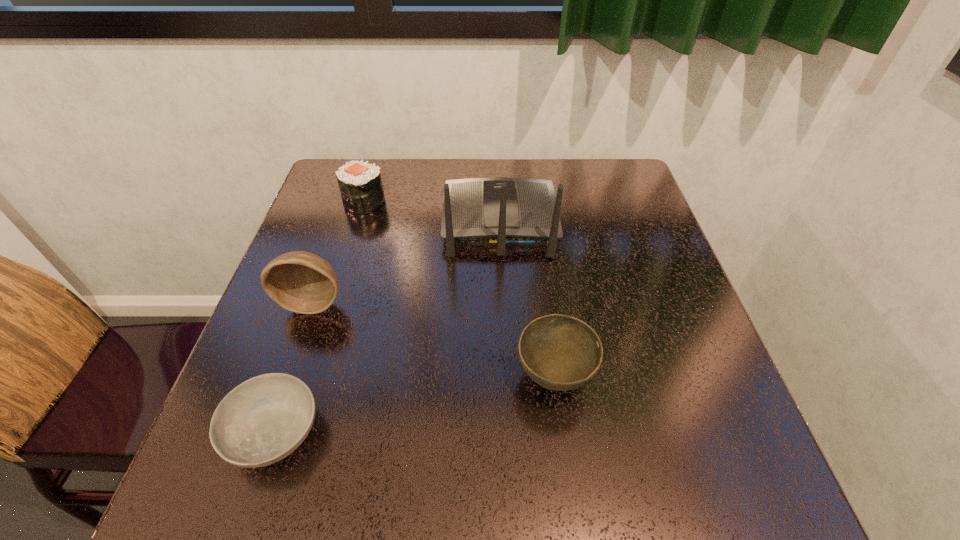
You are a GUI agent. You are given a task and a screenshot of the screen. Output one action in this format:
    pyautogui.click(x=<x>, y=<y>)
    Task: Click on the vacant space located 0.100m on the back of the sushi
    
    Given the screenshot: What is the action you would take?
    pyautogui.click(x=374, y=170)

At what (x,y) coordinates should I click in order to perform the action: click on free location located on the right of the rightmost bowl. Please return your answer as a coordinate pair (x, y). Looking at the image, I should click on (652, 377).

This screenshot has height=540, width=960. I want to click on free space located 0.160m on the back of the shortest bowl, so click(312, 321).

In order to click on router at the far edge in this screenshot , I will do `click(498, 211)`.

This screenshot has width=960, height=540. Identify the location of sushi at the far edge. (361, 187).

Find the location of a particular element. This screenshot has height=540, width=960. object that is positioned at the near edge is located at coordinates (263, 420).

You are a GUI agent. You are given a task and a screenshot of the screen. Output one action in this format:
    pyautogui.click(x=<x>, y=<y>)
    Task: Click on the sushi that is at the left edge
    The width and height of the screenshot is (960, 540).
    Given the screenshot: What is the action you would take?
    pyautogui.click(x=361, y=187)

In order to click on object that is at the far left corner in this screenshot , I will do `click(361, 187)`.

Find the location of a particular element. object that is at the near left corner is located at coordinates (263, 420).

Identify the location of free space at the far edge of the desktop. The image size is (960, 540). (581, 205).